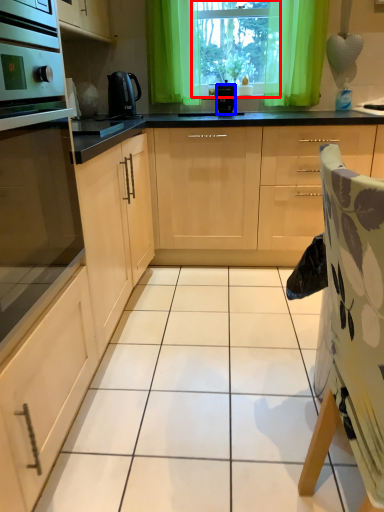
Question: Which object appears closest to the camera in this image, window screen (highlighted by a red box) or kitchen appliance (highlighted by a blue box)?

Choices:
 (A) window screen
 (B) kitchen appliance

Answer: (B)